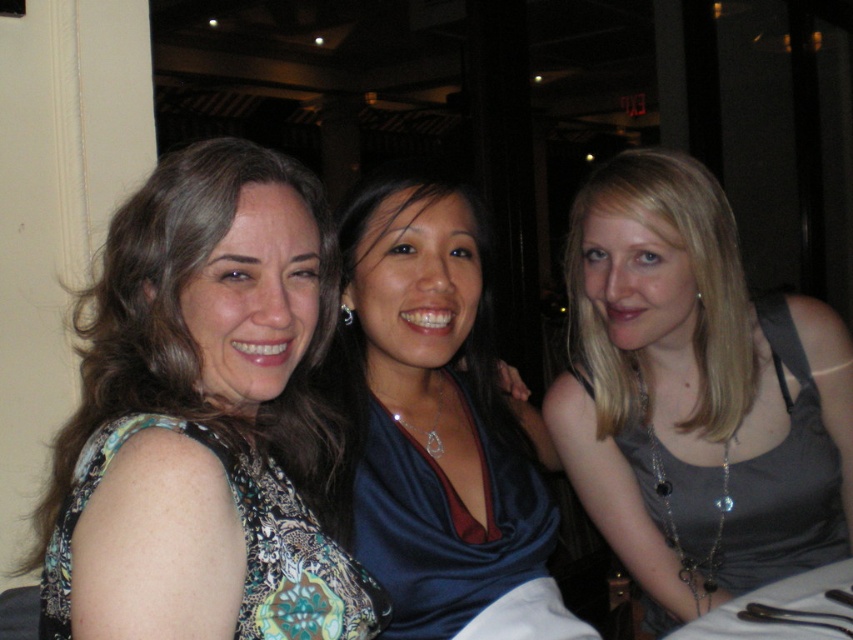
Question: Which point is farther from the camera taking this photo?

Choices:
 (A) (817, 301)
 (B) (189, 397)

Answer: (A)

Question: Does gray fabric tank top at right have a smaller size compared to patterned fabric dress at center?

Choices:
 (A) no
 (B) yes

Answer: (B)

Question: Estimate the real-world distances between objects in this image. Which object is closer to the blue satin dress at center?

Choices:
 (A) gray fabric tank top at right
 (B) patterned fabric dress at center

Answer: (B)

Question: Is gray fabric tank top at right further to camera compared to patterned fabric dress at center?

Choices:
 (A) yes
 (B) no

Answer: (A)

Question: Which object is closer to the camera taking this photo?

Choices:
 (A) patterned fabric dress at center
 (B) gray fabric tank top at right
 (C) blue satin dress at center

Answer: (A)

Question: In this image, where is gray fabric tank top at right located relative to patterned fabric dress at center?

Choices:
 (A) left
 (B) right

Answer: (B)